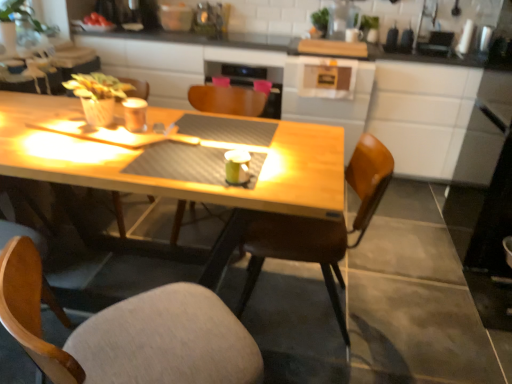
At what (x,y) coordinates should I click in order to perform the action: click on vacant location behind green matte mug at center, marked as the second coffee cup in a back-to-front arrangement. Please return your answer as a coordinate pair (x, y). Image resolution: width=512 pixels, height=384 pixels. Looking at the image, I should click on (224, 160).